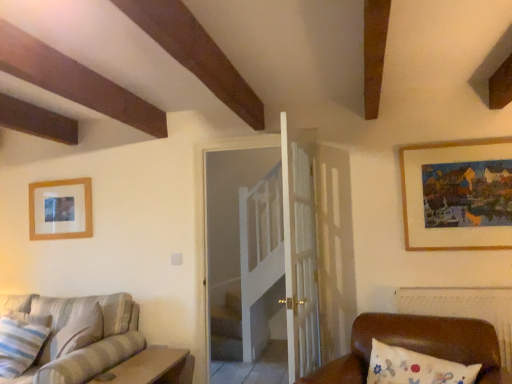
Where is `vacant region above white wooden door at center (from a real-world perspective)`? vacant region above white wooden door at center (from a real-world perspective) is located at coordinates (245, 137).